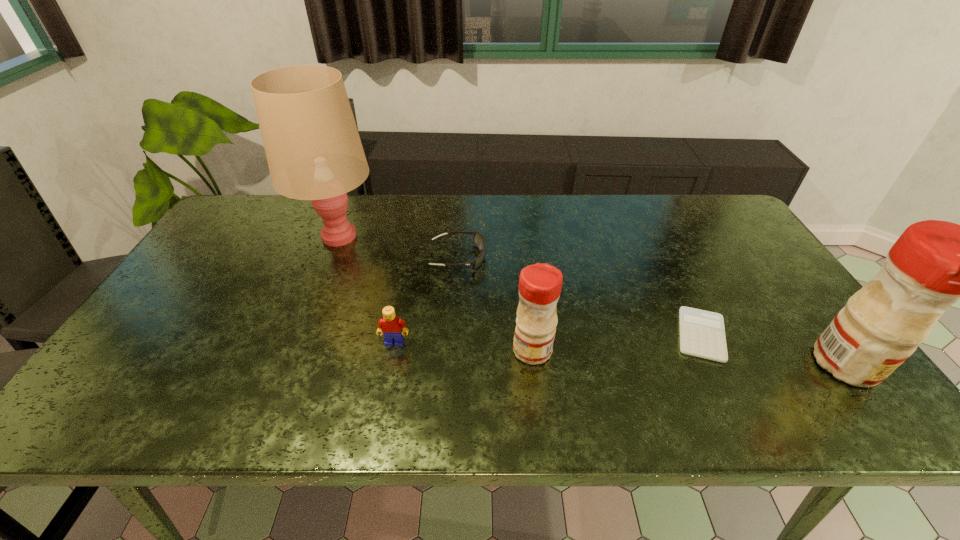
Given the evenly spaced condiments in the image, where should an extra condiment be added on the left to preserve the spacing? Please point to a vacant space. Please provide its 2D coordinates. Your answer should be formatted as a tuple, i.e. [(x, y)], where the tuple contains the x and y coordinates of a point satisfying the conditions above.

[(237, 336)]